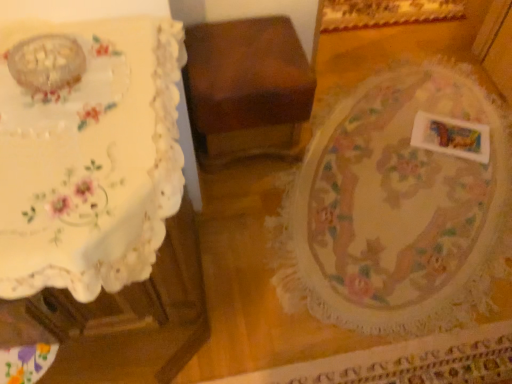
Identify the location of empty space that is ontop of wooden box at center (from a real-world perspective). (245, 52).